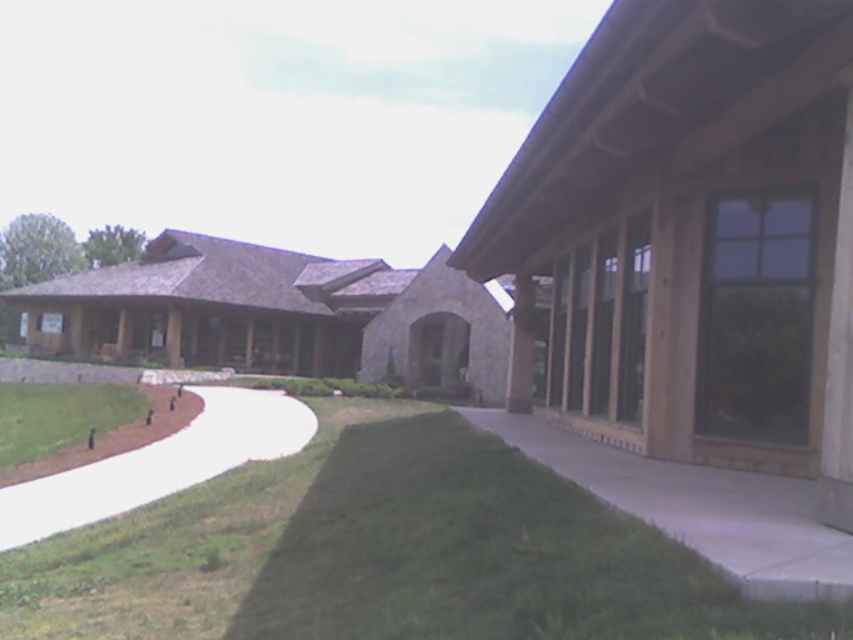
You are standing at the entrance of the building and want to walk to the green grass at lower center. Based on the 2D coordinates provided, in which direction should you move relative to your current position?

The green grass at lower center is located at coordinates point (384, 552), so you should move towards the lower center direction from your current position at the entrance.

You are a gardener planning to mow the lawn. You see the green grass at lower center and the concrete at center. Which area should you avoid mowing?

You should avoid mowing the concrete at center because the green grass at lower center is in front of it, meaning the concrete is behind and not part of the lawn area.